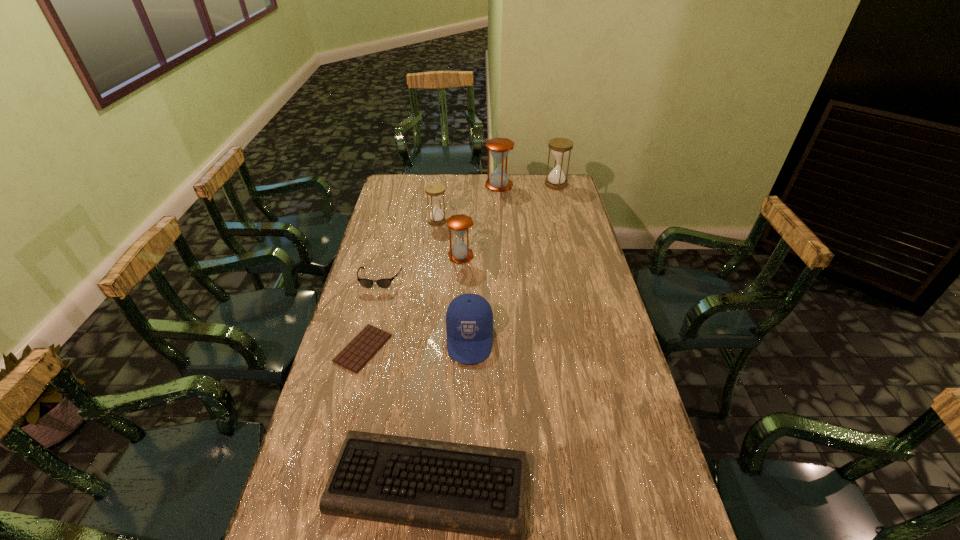
Image resolution: width=960 pixels, height=540 pixels. Identify the location of free space located 0.160m on the back of the shortest object. (377, 293).

Where is `sunglasses present at the left edge`? sunglasses present at the left edge is located at coordinates (366, 283).

You are a GUI agent. You are given a task and a screenshot of the screen. Output one action in this format:
    pyautogui.click(x=<x>, y=<y>)
    Task: Click on the chocolate bar situated at the left edge
    
    Given the screenshot: What is the action you would take?
    pyautogui.click(x=362, y=348)

The height and width of the screenshot is (540, 960). What are the coordinates of `object that is at the right edge` in the screenshot? It's located at (560, 147).

What are the coordinates of `object that is at the far right corner` in the screenshot? It's located at (560, 147).

Locate an element on the screen. This screenshot has width=960, height=540. vacant space at the far edge of the desktop is located at coordinates (492, 197).

Where is `vacant region at the left edge`? This screenshot has width=960, height=540. vacant region at the left edge is located at coordinates 374,265.

In the image, there is a desktop. In order to click on blank space at the right edge in this screenshot , I will do `click(582, 221)`.

In the image, there is a desktop. At what (x,y) coordinates should I click in order to perform the action: click on vacant space at the far left corner. Please return your answer as a coordinate pair (x, y). The height and width of the screenshot is (540, 960). Looking at the image, I should click on (396, 185).

Where is `vacant region between the left white hourglass and the bigger brown hourglass`? Image resolution: width=960 pixels, height=540 pixels. vacant region between the left white hourglass and the bigger brown hourglass is located at coordinates (468, 202).